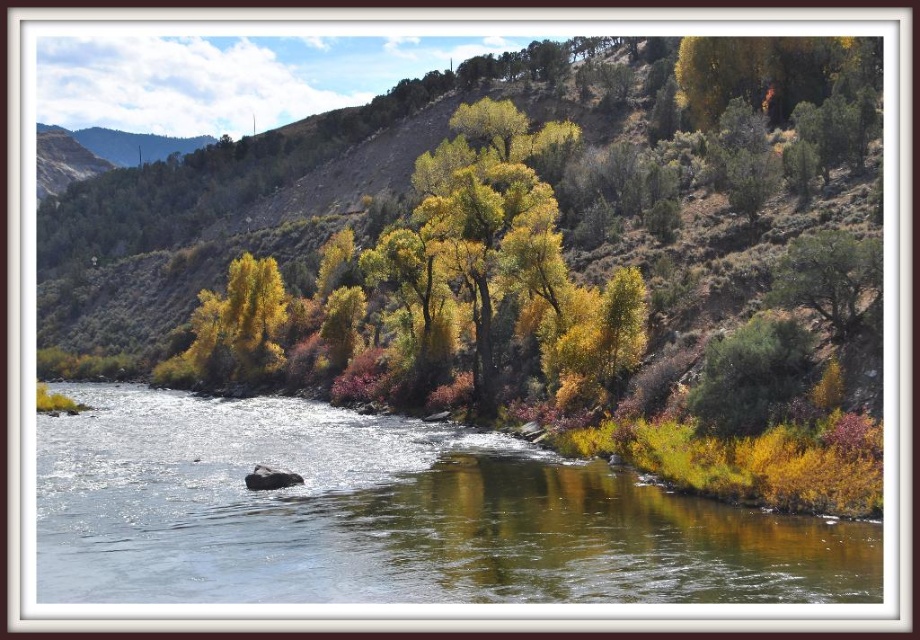
Question: Does greenish reflective water at center appear on the left side of green leafy tree at center-right?

Choices:
 (A) yes
 (B) no

Answer: (A)

Question: Which object is farther from the camera taking this photo?

Choices:
 (A) greenish reflective water at center
 (B) green leafy tree at center-right

Answer: (B)

Question: Does greenish reflective water at center appear under green leafy tree at center-right?

Choices:
 (A) yes
 (B) no

Answer: (A)

Question: Which of the following is the closest to the observer?

Choices:
 (A) (460, 465)
 (B) (843, 305)

Answer: (B)

Question: Does greenish reflective water at center have a greater width compared to green leafy tree at center-right?

Choices:
 (A) yes
 (B) no

Answer: (A)